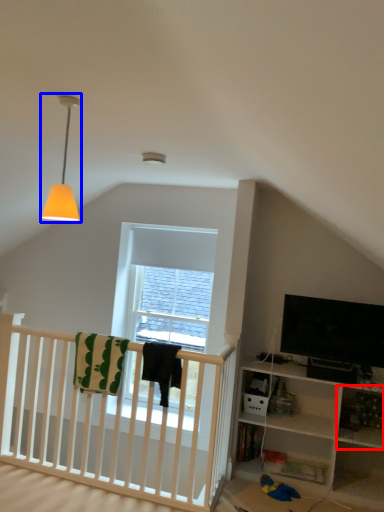
Question: Which object is closer to the camera taking this photo, shelf (highlighted by a red box) or lamp (highlighted by a blue box)?

Choices:
 (A) shelf
 (B) lamp

Answer: (B)